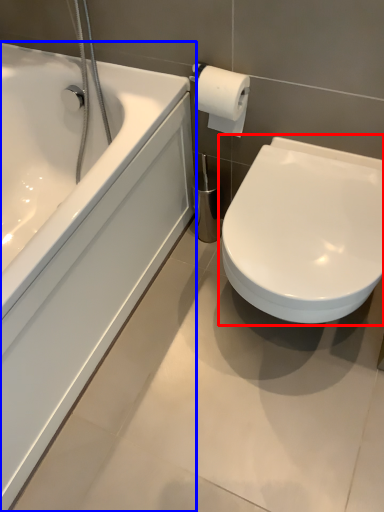
Question: Which object appears farthest to the camera in this image, toilet (highlighted by a red box) or bathtub (highlighted by a blue box)?

Choices:
 (A) toilet
 (B) bathtub

Answer: (A)